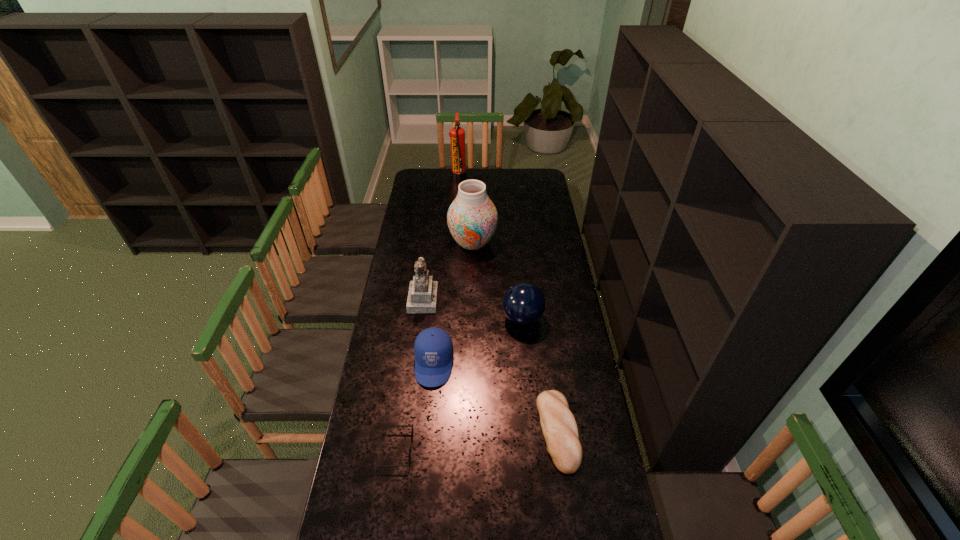
Where is `the farthest object`? This screenshot has height=540, width=960. the farthest object is located at coordinates (457, 134).

At what (x,y) coordinates should I click in order to perform the action: click on the second farthest object. Please return your answer as a coordinate pair (x, y). Looking at the image, I should click on (472, 218).

Locate an element on the screen. figurine is located at coordinates (422, 297).

Image resolution: width=960 pixels, height=540 pixels. What are the coordinates of `the fourth shortest object` in the screenshot? It's located at click(x=524, y=304).

The width and height of the screenshot is (960, 540). I want to click on cap, so click(433, 349).

Find the location of a particular element. the third nearest object is located at coordinates (433, 349).

The image size is (960, 540). I want to click on the second shortest object, so click(x=559, y=427).

The width and height of the screenshot is (960, 540). Identify the location of the shortest object. coord(393,425).

Locate an element on the screen. free spot located 0.050m with the nozzle pointing from the back of the fire extinguisher is located at coordinates (474, 176).

This screenshot has width=960, height=540. What are the coordinates of `vacant space located 0.140m on the front of the sixth nearest object` in the screenshot? It's located at coord(472,278).